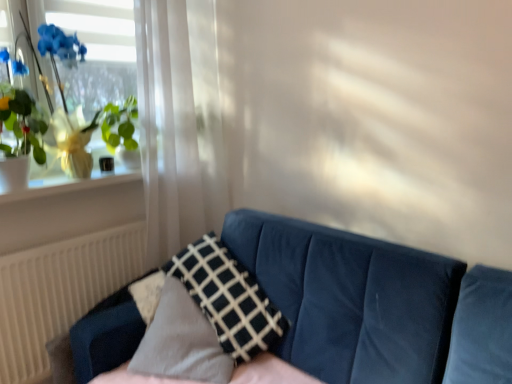
Question: Considering the relative positions of white sheer curtain at left and dark blue fabric pillow at center in the image provided, is white sheer curtain at left to the right of dark blue fabric pillow at center from the viewer's perspective?

Choices:
 (A) no
 (B) yes

Answer: (A)

Question: Is white sheer curtain at left positioned far away from dark blue fabric pillow at center?

Choices:
 (A) no
 (B) yes

Answer: (A)

Question: From the image's perspective, is white sheer curtain at left located beneath dark blue fabric pillow at center?

Choices:
 (A) no
 (B) yes

Answer: (A)

Question: Is white sheer curtain at left thinner than dark blue fabric pillow at center?

Choices:
 (A) yes
 (B) no

Answer: (A)

Question: From a real-world perspective, is white sheer curtain at left located higher than dark blue fabric pillow at center?

Choices:
 (A) yes
 (B) no

Answer: (A)

Question: Is velvet blue couch at center taller or shorter than green leafy plant at left?

Choices:
 (A) short
 (B) tall

Answer: (B)

Question: Is velvet blue couch at center situated inside green leafy plant at left or outside?

Choices:
 (A) outside
 (B) inside

Answer: (A)

Question: From a real-world perspective, is velvet blue couch at center positioned above or below green leafy plant at left?

Choices:
 (A) above
 (B) below

Answer: (B)

Question: Considering the positions of velvet blue couch at center and green leafy plant at left in the image, is velvet blue couch at center wider or thinner than green leafy plant at left?

Choices:
 (A) thin
 (B) wide

Answer: (B)

Question: Is dark blue fabric pillow at center wider or thinner than green leafy plant at left?

Choices:
 (A) thin
 (B) wide

Answer: (B)

Question: Is point (239, 284) closer or farther from the camera than point (40, 125)?

Choices:
 (A) farther
 (B) closer

Answer: (B)

Question: Based on their sizes in the image, would you say dark blue fabric pillow at center is bigger or smaller than green leafy plant at left?

Choices:
 (A) big
 (B) small

Answer: (A)

Question: Is dark blue fabric pillow at center in front of or behind green leafy plant at left in the image?

Choices:
 (A) front
 (B) behind

Answer: (A)

Question: From the image's perspective, is white glossy window sill at upper left positioned above or below white textured radiator at lower left?

Choices:
 (A) above
 (B) below

Answer: (A)

Question: From a real-world perspective, is white glossy window sill at upper left physically located above or below white textured radiator at lower left?

Choices:
 (A) below
 (B) above

Answer: (B)